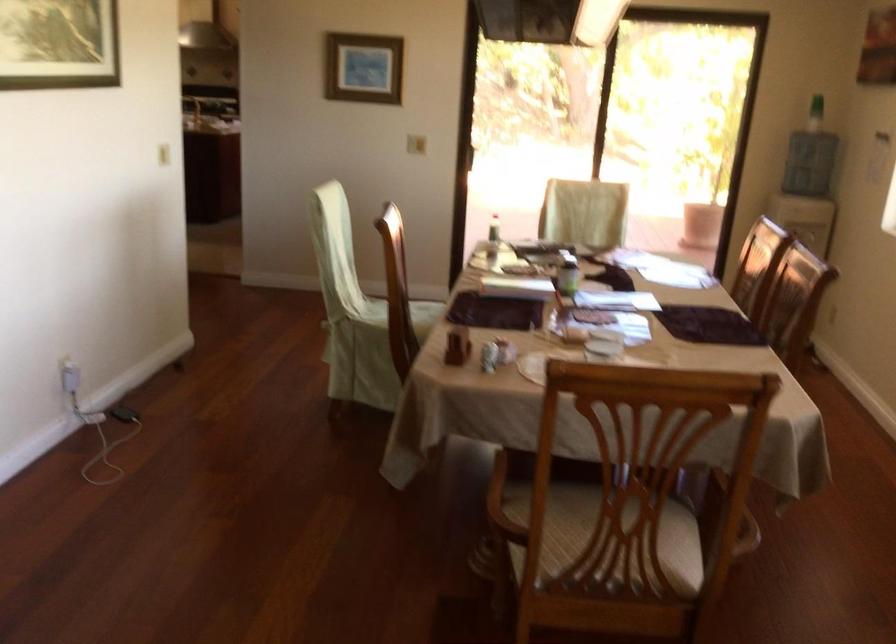
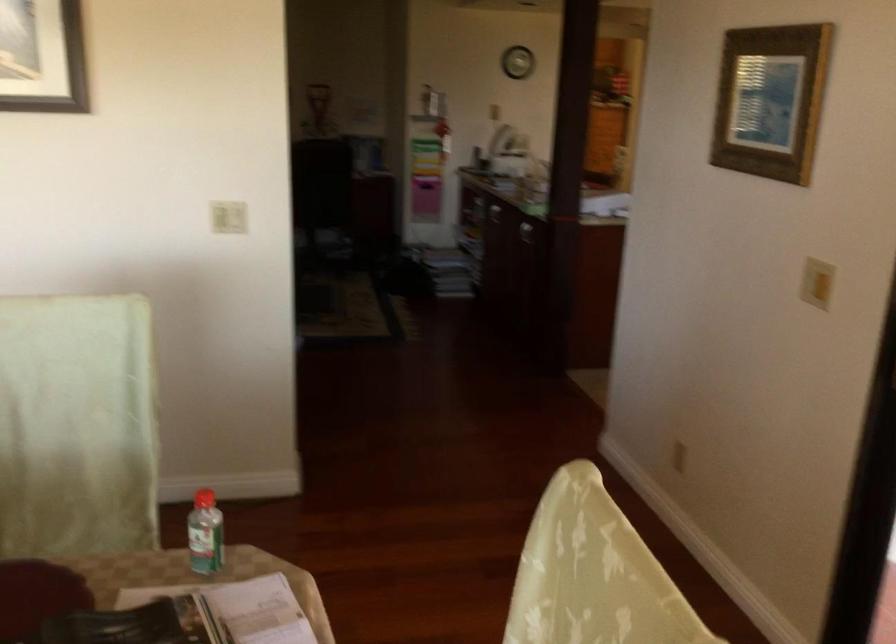
Locate, in the second image, the point that corresponds to the point at 426,126 in the first image.

(816, 283)